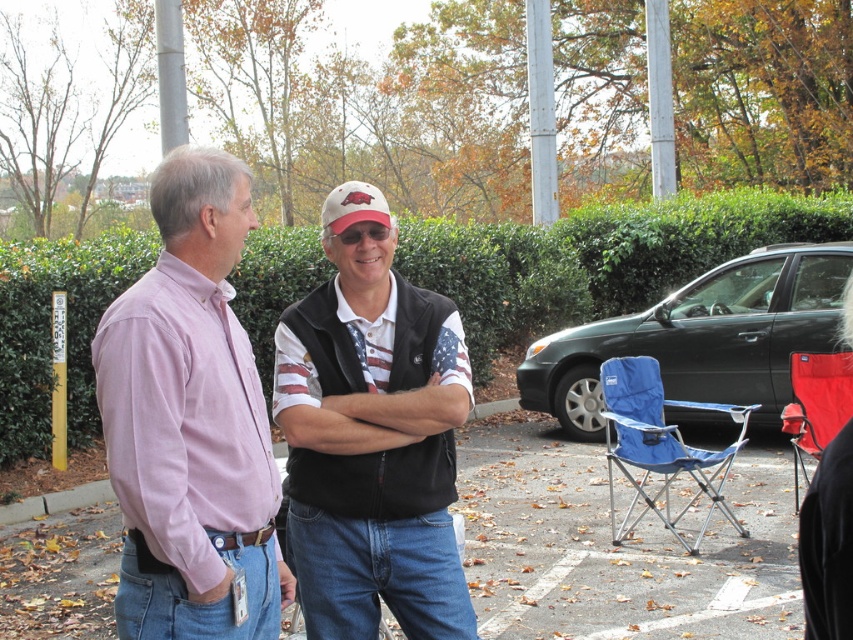
Question: Which point is farther to the camera?

Choices:
 (A) pink cotton shirt at center
 (B) american flag fabric vest at center
 (C) dark green matte car at right

Answer: (C)

Question: Is american flag fabric vest at center thinner than dark green matte car at right?

Choices:
 (A) no
 (B) yes

Answer: (B)

Question: Does pink cotton shirt at center lie behind dark green matte car at right?

Choices:
 (A) no
 (B) yes

Answer: (A)

Question: In this image, where is dark green matte car at right located relative to white matte baseball cap at center?

Choices:
 (A) left
 (B) right

Answer: (B)

Question: Estimate the real-world distances between objects in this image. Which object is closer to the dark green matte car at right?

Choices:
 (A) white matte baseball cap at center
 (B) american flag fabric vest at center

Answer: (A)

Question: Which object is closer to the camera taking this photo?

Choices:
 (A) white matte baseball cap at center
 (B) pink cotton shirt at center
 (C) american flag fabric vest at center
 (D) dark green matte car at right

Answer: (B)